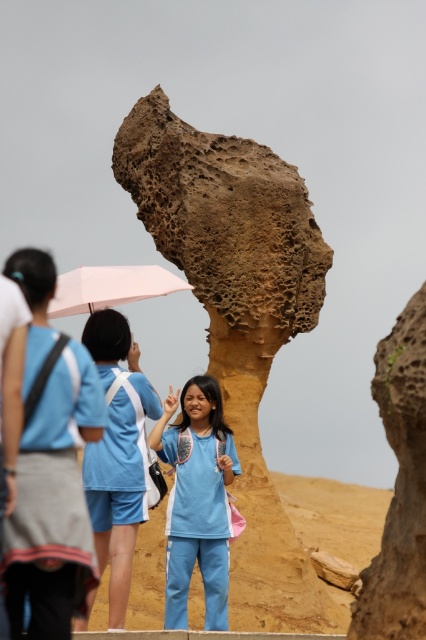
Looking at this image, which of these two, light blue fabric backpack at left or brown rough rock at center, stands shorter?

Standing shorter between the two is brown rough rock at center.

Which is more to the left, light blue fabric backpack at left or brown rough rock at center?

light blue fabric backpack at left is more to the left.

Between point (25, 582) and point (411, 564), which one is positioned in front?

Point (25, 582)

Where is `light blue fabric backpack at left`? This screenshot has height=640, width=426. light blue fabric backpack at left is located at coordinates click(57, 502).

Between point (210, 314) and point (34, 349), which one is positioned in front?

Point (34, 349) is in front.

What do you see at coordinates (238, 316) in the screenshot?
I see `brown porous rock at center` at bounding box center [238, 316].

Locate an element on the screen. The height and width of the screenshot is (640, 426). brown porous rock at center is located at coordinates (238, 316).

Can you confirm if light blue fabric at center is taller than white matte umbrella at center?

Yes.

Which of these two, light blue fabric at center or white matte umbrella at center, stands taller?

light blue fabric at center

Locate an element on the screen. The width and height of the screenshot is (426, 640). light blue fabric at center is located at coordinates (196, 499).

At what (x,y) coordinates should I click in order to perform the action: click on light blue fabric at center. Please return your answer as a coordinate pair (x, y). This screenshot has height=640, width=426. Looking at the image, I should click on (196, 499).